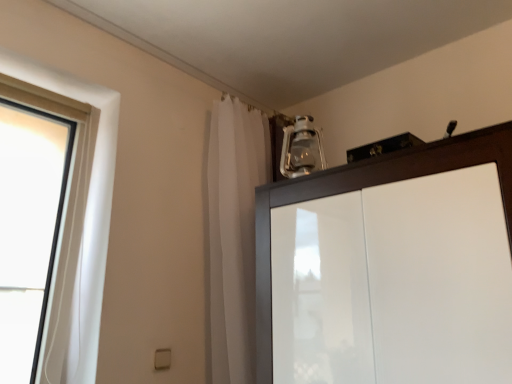
Question: Is glossy wood cupboard at upper right thinner than white sheer curtain at upper center?

Choices:
 (A) no
 (B) yes

Answer: (A)

Question: From the image's perspective, is glossy wood cupboard at upper right over white sheer curtain at upper center?

Choices:
 (A) no
 (B) yes

Answer: (A)

Question: Does glossy wood cupboard at upper right lie behind white sheer curtain at upper center?

Choices:
 (A) no
 (B) yes

Answer: (A)

Question: Does glossy wood cupboard at upper right appear on the right side of white sheer curtain at upper center?

Choices:
 (A) yes
 (B) no

Answer: (A)

Question: From a real-world perspective, is glossy wood cupboard at upper right located higher than white sheer curtain at upper center?

Choices:
 (A) no
 (B) yes

Answer: (A)

Question: Is glossy wood cupboard at upper right surrounding white sheer curtain at upper center?

Choices:
 (A) no
 (B) yes

Answer: (A)

Question: Is white sheer curtain at upper center at the right side of clear glass lantern at upper center?

Choices:
 (A) no
 (B) yes

Answer: (A)

Question: Can you confirm if white sheer curtain at upper center is shorter than clear glass lantern at upper center?

Choices:
 (A) no
 (B) yes

Answer: (A)

Question: Would you say white sheer curtain at upper center is outside clear glass lantern at upper center?

Choices:
 (A) yes
 (B) no

Answer: (A)

Question: Does white sheer curtain at upper center turn towards clear glass lantern at upper center?

Choices:
 (A) no
 (B) yes

Answer: (B)

Question: Is the position of white sheer curtain at upper center more distant than that of clear glass lantern at upper center?

Choices:
 (A) yes
 (B) no

Answer: (B)

Question: Considering the relative sizes of white sheer curtain at upper center and clear glass lantern at upper center in the image provided, is white sheer curtain at upper center wider than clear glass lantern at upper center?

Choices:
 (A) yes
 (B) no

Answer: (A)

Question: Is clear glass lantern at upper center in front of white sheer curtain at upper center?

Choices:
 (A) no
 (B) yes

Answer: (A)